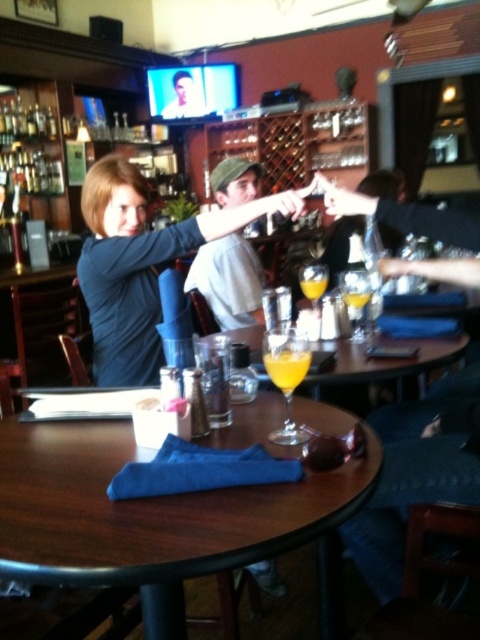
Question: Among these points, which one is nearest to the camera?

Choices:
 (A) (311, 300)
 (B) (141, 513)
 (C) (418, 358)

Answer: (B)

Question: Which object appears farthest from the camera in this image?

Choices:
 (A) green cap at center
 (B) translucent glass juice at center
 (C) translucent glass at table center
 (D) orange liquid glass at table center

Answer: (A)

Question: Does wooden table at center have a smaller size compared to translucent glass juice at center?

Choices:
 (A) no
 (B) yes

Answer: (A)

Question: Estimate the real-world distances between objects in this image. Which object is farther from the translucent glass at table center?

Choices:
 (A) orange liquid glass at table center
 (B) green cap at center
 (C) translucent glass juice at center

Answer: (B)

Question: Does wooden table at center have a smaller size compared to translucent glass juice at center?

Choices:
 (A) no
 (B) yes

Answer: (A)

Question: Is matte blue shirt at center positioned in front of translucent glass at table center?

Choices:
 (A) no
 (B) yes

Answer: (A)